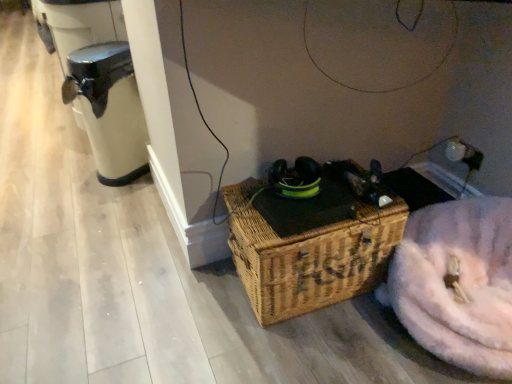
What are the coordinates of `white fluffy washer at lower right` in the screenshot? It's located at tap(457, 283).

I want to click on white fluffy washer at lower right, so click(457, 283).

Locate an element on the screen. The height and width of the screenshot is (384, 512). picnic basket to the left of white fluffy washer at lower right is located at coordinates (308, 256).

Which is in front, white fluffy washer at lower right or woven brown picnic basket at center?

white fluffy washer at lower right is closer to the camera.

From the image's perspective, would you say white fluffy washer at lower right is shown under woven brown picnic basket at center?

Yes, from the image's perspective, white fluffy washer at lower right is below woven brown picnic basket at center.

Is woven brown picnic basket at center shorter than black plastic water heater at left?

Yes.

Can you confirm if woven brown picnic basket at center is positioned to the left of black plastic water heater at left?

No.

Identify the location of picnic basket in front of the black plastic water heater at left. The width and height of the screenshot is (512, 384). (308, 256).

Considering the relative sizes of black plastic water heater at left and woven brown picnic basket at center in the image provided, is black plastic water heater at left bigger than woven brown picnic basket at center?

Actually, black plastic water heater at left might be smaller than woven brown picnic basket at center.

From their relative heights in the image, would you say black plastic water heater at left is taller or shorter than woven brown picnic basket at center?

black plastic water heater at left is taller than woven brown picnic basket at center.

From a real-world perspective, which object stands above the other?

black plastic water heater at left, from a real-world perspective.

From the image's perspective, does woven brown picnic basket at center appear higher than white fluffy washer at lower right?

Yes, from the image's perspective, woven brown picnic basket at center is on top of white fluffy washer at lower right.

Is woven brown picnic basket at center not within white fluffy washer at lower right?

Yes, woven brown picnic basket at center is located beyond the bounds of white fluffy washer at lower right.

Considering the sizes of woven brown picnic basket at center and white fluffy washer at lower right in the image, is woven brown picnic basket at center taller or shorter than white fluffy washer at lower right?

In the image, woven brown picnic basket at center appears to be taller than white fluffy washer at lower right.

From the image's perspective, is black plastic water heater at left positioned above or below white fluffy washer at lower right?

From the image's perspective, black plastic water heater at left appears above white fluffy washer at lower right.

Between black plastic water heater at left and white fluffy washer at lower right, which one appears on the right side from the viewer's perspective?

Positioned to the right is white fluffy washer at lower right.

Who is shorter, black plastic water heater at left or white fluffy washer at lower right?

white fluffy washer at lower right is shorter.

Locate an element on the screen. The height and width of the screenshot is (384, 512). water heater that appears above the white fluffy washer at lower right (from a real-world perspective) is located at coordinates (109, 109).

Is point (457, 230) less distant than point (71, 82)?

Yes, point (457, 230) is in front of point (71, 82).

How far apart are white fluffy washer at lower right and black plastic water heater at left?

white fluffy washer at lower right is 1.61 meters from black plastic water heater at left.

Between white fluffy washer at lower right and black plastic water heater at left, which one appears on the right side from the viewer's perspective?

white fluffy washer at lower right.

Is white fluffy washer at lower right bigger or smaller than black plastic water heater at left?

Considering their sizes, white fluffy washer at lower right takes up more space than black plastic water heater at left.

You are a GUI agent. You are given a task and a screenshot of the screen. Output one action in this format:
    pyautogui.click(x=<x>, y=<y>)
    Task: Click on the washer located underneath the woven brown picnic basket at center (from a real-world perspective)
    Image resolution: width=512 pixels, height=384 pixels.
    Given the screenshot: What is the action you would take?
    pyautogui.click(x=457, y=283)

Find the location of a particular element. Image resolution: width=512 pixels, height=384 pixels. water heater above the woven brown picnic basket at center (from a real-world perspective) is located at coordinates (109, 109).

Based on their spatial positions, is white fluffy washer at lower right or woven brown picnic basket at center further from black plastic water heater at left?

white fluffy washer at lower right.

Based on their spatial positions, is black plastic water heater at left or woven brown picnic basket at center further from white fluffy washer at lower right?

black plastic water heater at left is further to white fluffy washer at lower right.

Looking at the image, which one is located closer to black plastic water heater at left, woven brown picnic basket at center or white fluffy washer at lower right?

Based on the image, woven brown picnic basket at center appears to be nearer to black plastic water heater at left.

Estimate the real-world distances between objects in this image. Which object is closer to woven brown picnic basket at center, white fluffy washer at lower right or black plastic water heater at left?

white fluffy washer at lower right is positioned closer to the anchor woven brown picnic basket at center.

Which object lies nearer to the anchor point white fluffy washer at lower right, woven brown picnic basket at center or black plastic water heater at left?

Among the two, woven brown picnic basket at center is located nearer to white fluffy washer at lower right.

Which object lies further to the anchor point woven brown picnic basket at center, black plastic water heater at left or white fluffy washer at lower right?

black plastic water heater at left.

You are a GUI agent. You are given a task and a screenshot of the screen. Output one action in this format:
    pyautogui.click(x=<x>, y=<y>)
    Task: Click on the picnic basket between black plastic water heater at left and white fluffy washer at lower right in the horizontal direction
    This screenshot has height=384, width=512.
    Given the screenshot: What is the action you would take?
    pyautogui.click(x=308, y=256)